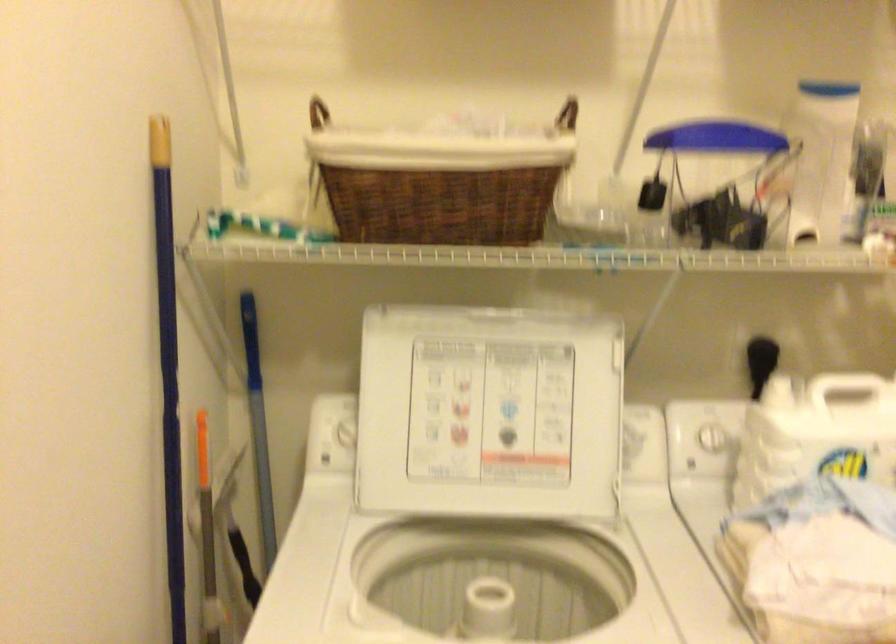
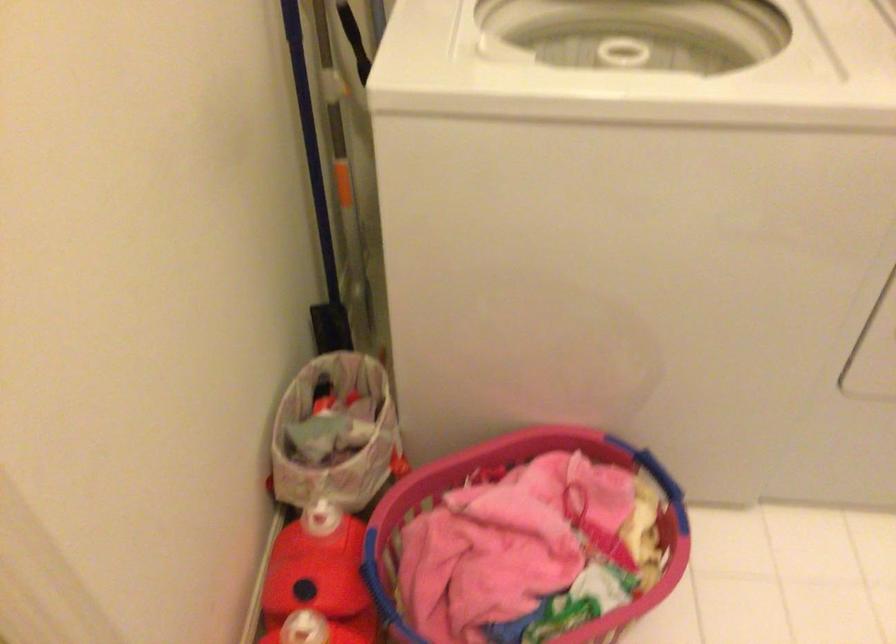
Question: The images are taken continuously from a first-person perspective. In which direction is your viewpoint rotating?

Choices:
 (A) Left
 (B) Right
 (C) Up
 (D) Down

Answer: (D)